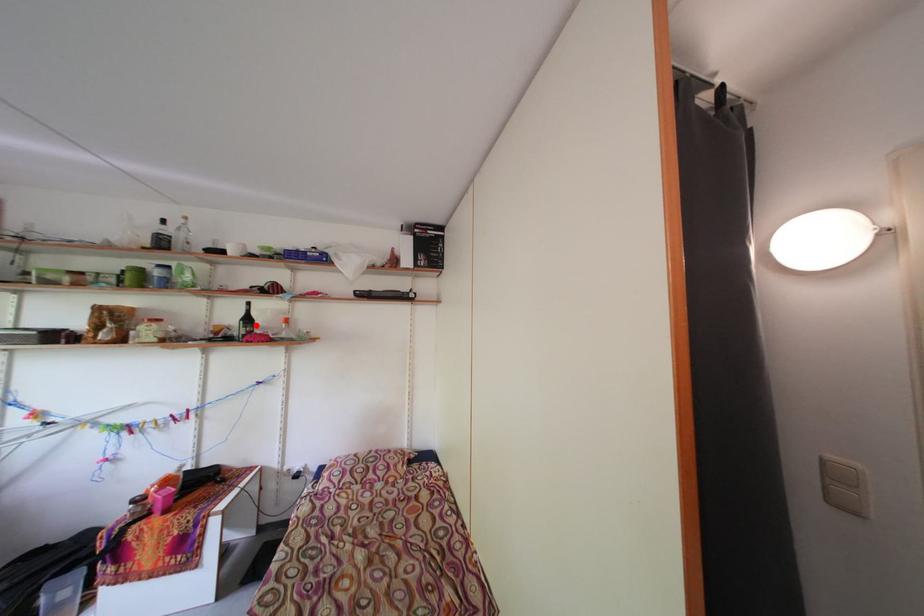
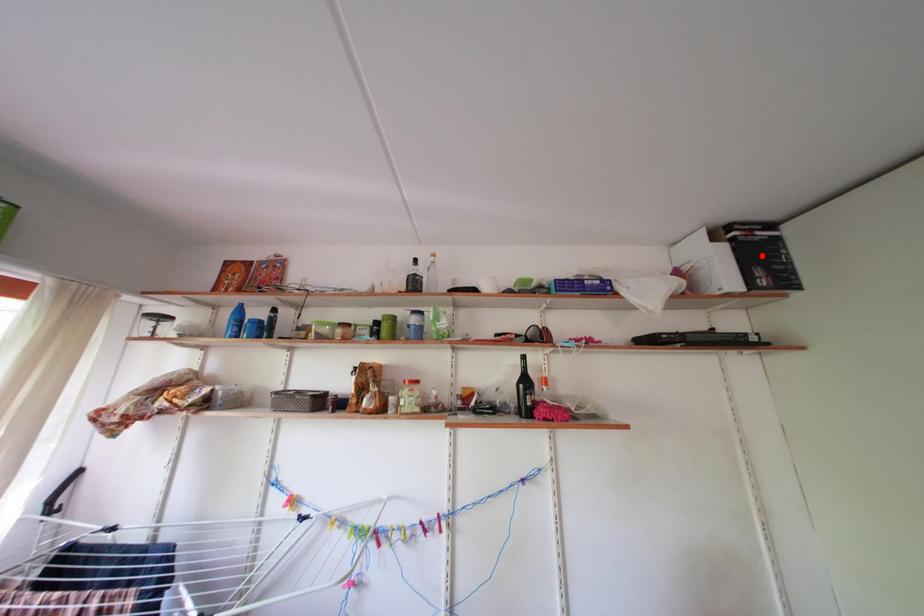
I am providing you with two images of the same scene from different viewpoints. A red point is marked on the first image and another point is marked on the second image. Is the red point in image1 aligned with the point shown in image2?

Result: No